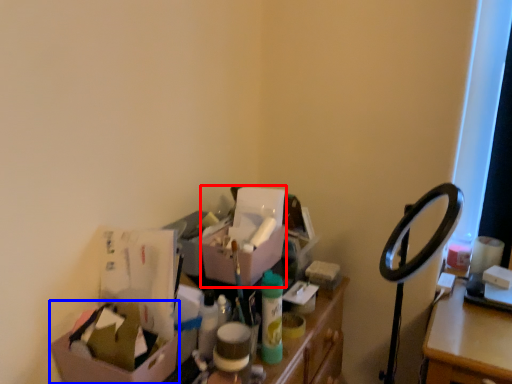
Question: Which of the following is the farthest to the observer, box (highlighted by a red box) or box (highlighted by a blue box)?

Choices:
 (A) box
 (B) box

Answer: (A)